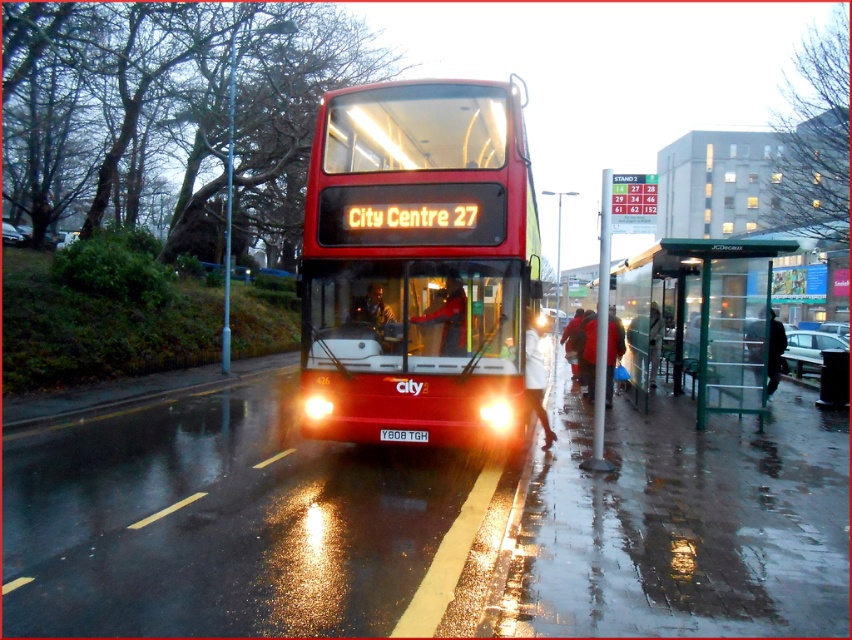
Question: Can you confirm if shiny red bus at center is positioned below white plastic license plate at center?

Choices:
 (A) no
 (B) yes

Answer: (A)

Question: Based on their relative distances, which object is farther from the matte black jacket at center?

Choices:
 (A) white matte coat at lower center
 (B) red wool coat at lower right
 (C) white plastic license plate at center
 (D) shiny red bus at center

Answer: (B)

Question: Is red wool coat at lower right above dark blue jacket at right?

Choices:
 (A) no
 (B) yes

Answer: (A)

Question: Estimate the real-world distances between objects in this image. Which object is farther from the dark blue jacket at right?

Choices:
 (A) red wool coat at lower right
 (B) green transparent bus stop at right
 (C) red leather jacket at center
 (D) white plastic license plate at center

Answer: (D)

Question: Which object is the closest to the shiny red bus at center?

Choices:
 (A) green transparent bus stop at right
 (B) white plastic license plate at center
 (C) red wool coat at lower right

Answer: (B)

Question: Can you confirm if green transparent bus stop at right is smaller than matte black jacket at center?

Choices:
 (A) yes
 (B) no

Answer: (B)